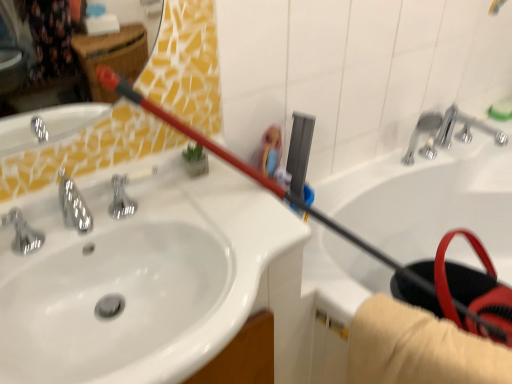
The width and height of the screenshot is (512, 384). What are the coordinates of `chrome metallic faucet at upper right, marked as the second plumbing fixture in a right-to-left arrangement` in the screenshot? It's located at (424, 132).

Image resolution: width=512 pixels, height=384 pixels. What are the coordinates of `silver metallic faucet at left` in the screenshot? It's located at (22, 233).

Where is `chrome metallic faucet at upper right, marked as the second plumbing fixture in a right-to-left arrangement`? Image resolution: width=512 pixels, height=384 pixels. chrome metallic faucet at upper right, marked as the second plumbing fixture in a right-to-left arrangement is located at coordinates (424, 132).

Considering the relative sizes of silver metallic faucet at upper right, the first plumbing fixture from the right, and white glossy sink at upper left in the image provided, is silver metallic faucet at upper right, the first plumbing fixture from the right, wider than white glossy sink at upper left?

No.

Which object is closer to the camera taking this photo, silver metallic faucet at upper right, the first plumbing fixture from the right, or white glossy sink at upper left?

Positioned in front is white glossy sink at upper left.

Considering the sizes of objects silver metallic faucet at upper right, the second plumbing fixture from the left, and white glossy sink at upper left in the image provided, who is taller, silver metallic faucet at upper right, the second plumbing fixture from the left, or white glossy sink at upper left?

With more height is white glossy sink at upper left.

Would you say silver metallic faucet at upper right, the first plumbing fixture from the right, is outside white glossy sink at upper left?

Yes, silver metallic faucet at upper right, the first plumbing fixture from the right, is not within white glossy sink at upper left.

Is silver metallic faucet at left far from silver metallic faucet at upper right, the first plumbing fixture from the right?

Indeed, silver metallic faucet at left is not near silver metallic faucet at upper right, the first plumbing fixture from the right.

Is silver metallic faucet at left oriented away from silver metallic faucet at upper right, the first plumbing fixture from the right?

That's not correct — silver metallic faucet at left is not looking away from silver metallic faucet at upper right, the first plumbing fixture from the right.

Which is correct: silver metallic faucet at left is inside silver metallic faucet at upper right, the first plumbing fixture from the right, or outside of it?

silver metallic faucet at left exists outside the volume of silver metallic faucet at upper right, the first plumbing fixture from the right.

Relative to white glossy bathtub at upper right, is white glossy sink at upper left in front or behind?

In the image, white glossy sink at upper left appears in front of white glossy bathtub at upper right.

What's the angular difference between white glossy sink at upper left and white glossy bathtub at upper right's facing directions?

There is a 89.3-degree angle between the facing directions of white glossy sink at upper left and white glossy bathtub at upper right.

Is white glossy sink at upper left touching white glossy bathtub at upper right?

No, white glossy sink at upper left is not beside white glossy bathtub at upper right.

Is white glossy sink at upper left oriented towards white glossy bathtub at upper right?

No.

Would you consider chrome metallic faucet at upper right, marked as the second plumbing fixture in a right-to-left arrangement, to be distant from white glossy sink at upper left?

Absolutely, chrome metallic faucet at upper right, marked as the second plumbing fixture in a right-to-left arrangement, is distant from white glossy sink at upper left.

Is chrome metallic faucet at upper right, marked as the second plumbing fixture in a right-to-left arrangement, to the left or to the right of white glossy sink at upper left in the image?

Based on their positions, chrome metallic faucet at upper right, marked as the second plumbing fixture in a right-to-left arrangement, is located to the right of white glossy sink at upper left.

Considering the sizes of objects chrome metallic faucet at upper right, the first plumbing fixture in the left-to-right sequence, and white glossy sink at upper left in the image provided, who is thinner, chrome metallic faucet at upper right, the first plumbing fixture in the left-to-right sequence, or white glossy sink at upper left?

chrome metallic faucet at upper right, the first plumbing fixture in the left-to-right sequence.

Who is shorter, chrome metallic faucet at upper right, the first plumbing fixture in the left-to-right sequence, or white glossy sink at upper left?

chrome metallic faucet at upper right, the first plumbing fixture in the left-to-right sequence, is shorter.

Who is shorter, silver metallic faucet at left or white glossy sink at upper left?

Standing shorter between the two is silver metallic faucet at left.

You are a GUI agent. You are given a task and a screenshot of the screen. Output one action in this format:
    pyautogui.click(x=<x>, y=<y>)
    Task: Click on the sink in front of the silver metallic faucet at left
    The image size is (512, 384).
    Given the screenshot: What is the action you would take?
    pyautogui.click(x=128, y=290)

Consider the image. From the image's perspective, does silver metallic faucet at left appear lower than white glossy sink at upper left?

No, from the image's perspective, silver metallic faucet at left is not beneath white glossy sink at upper left.

In the scene shown: Considering their positions, is silver metallic faucet at upper right, the first plumbing fixture from the right, located in front of or behind white glossy bathtub at upper right?

Clearly, silver metallic faucet at upper right, the first plumbing fixture from the right, is behind white glossy bathtub at upper right.

From a real-world perspective, is silver metallic faucet at upper right, the second plumbing fixture from the left, over white glossy bathtub at upper right?

Yes, from a real-world perspective, silver metallic faucet at upper right, the second plumbing fixture from the left, is on top of white glossy bathtub at upper right.

Which of these two, silver metallic faucet at upper right, the second plumbing fixture from the left, or white glossy bathtub at upper right, is smaller?

With smaller size is silver metallic faucet at upper right, the second plumbing fixture from the left.

From the picture: Are silver metallic faucet at upper right, the first plumbing fixture from the right, and white glossy bathtub at upper right located far from each other?

silver metallic faucet at upper right, the first plumbing fixture from the right, is near white glossy bathtub at upper right, not far away.

From a real-world perspective, is white glossy bathtub at upper right on silver metallic faucet at left?

No, from a real-world perspective, white glossy bathtub at upper right is not above silver metallic faucet at left.

Considering the positions of objects white glossy bathtub at upper right and silver metallic faucet at left in the image provided, who is behind, white glossy bathtub at upper right or silver metallic faucet at left?

Positioned behind is silver metallic faucet at left.

From the image's perspective, between white glossy bathtub at upper right and silver metallic faucet at left, who is located below?

white glossy bathtub at upper right is shown below in the image.

Which of these two, white glossy bathtub at upper right or silver metallic faucet at left, stands taller?

white glossy bathtub at upper right.

The width and height of the screenshot is (512, 384). Find the location of `sink below the silver metallic faucet at upper right, the first plumbing fixture from the right (from a real-world perspective)`. sink below the silver metallic faucet at upper right, the first plumbing fixture from the right (from a real-world perspective) is located at coordinates (128, 290).

Starting from the silver metallic faucet at left, which plumbing fixture is the 1st one behind? Please provide its 2D coordinates.

[(446, 132)]

Estimate the real-world distances between objects in this image. Which object is closer to white glossy bathtub at upper right, silver metallic faucet at upper right, the first plumbing fixture from the right, or silver metallic faucet at left?

silver metallic faucet at upper right, the first plumbing fixture from the right.

When comparing their distances from chrome metallic faucet at upper right, the first plumbing fixture in the left-to-right sequence, does white glossy sink at upper left or silver metallic faucet at left seem further?

silver metallic faucet at left is positioned further to the anchor chrome metallic faucet at upper right, the first plumbing fixture in the left-to-right sequence.

Based on the photo, which object lies nearer to the anchor point silver metallic faucet at left, chrome metallic faucet at upper right, the first plumbing fixture in the left-to-right sequence, or white glossy sink at upper left?

Based on the image, white glossy sink at upper left appears to be nearer to silver metallic faucet at left.

Which object lies further to the anchor point chrome metallic faucet at upper right, the first plumbing fixture in the left-to-right sequence, silver metallic faucet at left or silver metallic faucet at upper right, the first plumbing fixture from the right?

silver metallic faucet at left is positioned further to the anchor chrome metallic faucet at upper right, the first plumbing fixture in the left-to-right sequence.

Estimate the real-world distances between objects in this image. Which object is closer to silver metallic faucet at left, silver metallic faucet at upper right, the first plumbing fixture from the right, or chrome metallic faucet at upper right, marked as the second plumbing fixture in a right-to-left arrangement?

chrome metallic faucet at upper right, marked as the second plumbing fixture in a right-to-left arrangement, lies closer to silver metallic faucet at left than the other object.

Based on their spatial positions, is silver metallic faucet at left or silver metallic faucet at upper right, the first plumbing fixture from the right, closer to white glossy sink at upper left?

Based on the image, silver metallic faucet at left appears to be nearer to white glossy sink at upper left.

Estimate the real-world distances between objects in this image. Which object is closer to white glossy bathtub at upper right, silver metallic faucet at left or chrome metallic faucet at upper right, the first plumbing fixture in the left-to-right sequence?

chrome metallic faucet at upper right, the first plumbing fixture in the left-to-right sequence.

From the image, which object appears to be nearer to white glossy sink at upper left, chrome metallic faucet at upper right, marked as the second plumbing fixture in a right-to-left arrangement, or silver metallic faucet at left?

silver metallic faucet at left is positioned closer to the anchor white glossy sink at upper left.

You are a GUI agent. You are given a task and a screenshot of the screen. Output one action in this format:
    pyautogui.click(x=<x>, y=<y>)
    Task: Click on the plumbing fixture between white glossy sink at upper left and silver metallic faucet at upper right, the first plumbing fixture from the right, in the horizontal direction
    
    Given the screenshot: What is the action you would take?
    pyautogui.click(x=424, y=132)

What are the coordinates of `sink between silver metallic faucet at left and silver metallic faucet at upper right, the second plumbing fixture from the left` in the screenshot? It's located at (x=128, y=290).

You are a GUI agent. You are given a task and a screenshot of the screen. Output one action in this format:
    pyautogui.click(x=<x>, y=<y>)
    Task: Click on the plumbing fixture located between white glossy bathtub at upper right and chrome metallic faucet at upper right, marked as the second plumbing fixture in a right-to-left arrangement, in the depth direction
    
    Given the screenshot: What is the action you would take?
    pyautogui.click(x=446, y=132)

Where is `sink located between silver metallic faucet at left and chrome metallic faucet at upper right, marked as the second plumbing fixture in a right-to-left arrangement, in the left-right direction`? sink located between silver metallic faucet at left and chrome metallic faucet at upper right, marked as the second plumbing fixture in a right-to-left arrangement, in the left-right direction is located at coordinates (128, 290).